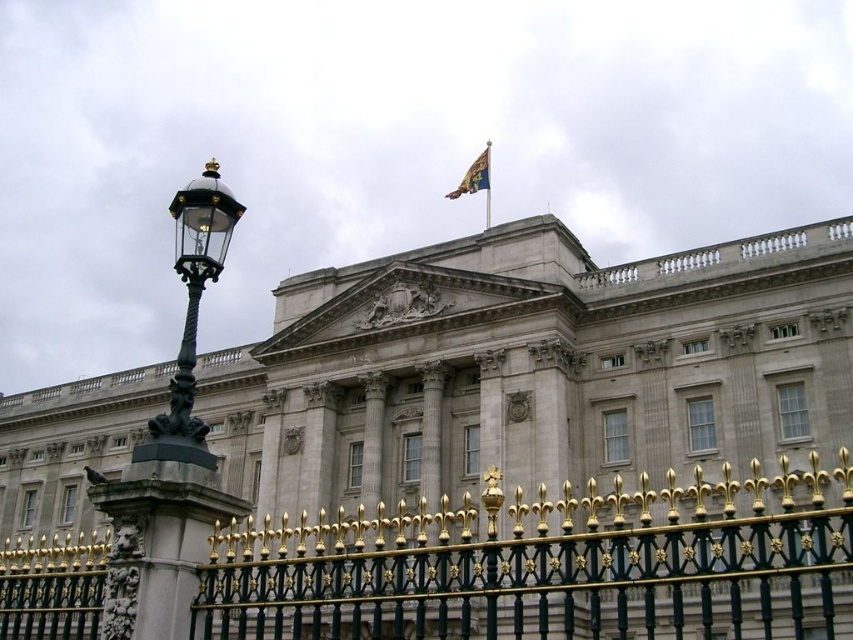
Question: Which point appears farthest from the camera in this image?

Choices:
 (A) (479, 157)
 (B) (224, 209)

Answer: (A)

Question: Can you confirm if gold textured flag at upper center is positioned above gold metallic flag pole at upper center?

Choices:
 (A) no
 (B) yes

Answer: (B)

Question: Is stone facade building at center positioned at the back of gold metallic flag pole at upper center?

Choices:
 (A) no
 (B) yes

Answer: (A)

Question: Which is farther from the gold textured flag at upper center?

Choices:
 (A) stone facade building at center
 (B) gold metallic flag pole at upper center
 (C) polished brass lamp post at left
 (D) gold wrought iron fence at center

Answer: (D)

Question: Where is gold wrought iron fence at center located in relation to polished brass lamp post at left in the image?

Choices:
 (A) below
 (B) above

Answer: (A)

Question: Which point appears farthest from the camera in this image?

Choices:
 (A) (601, 612)
 (B) (543, 477)
 (C) (184, 369)

Answer: (B)